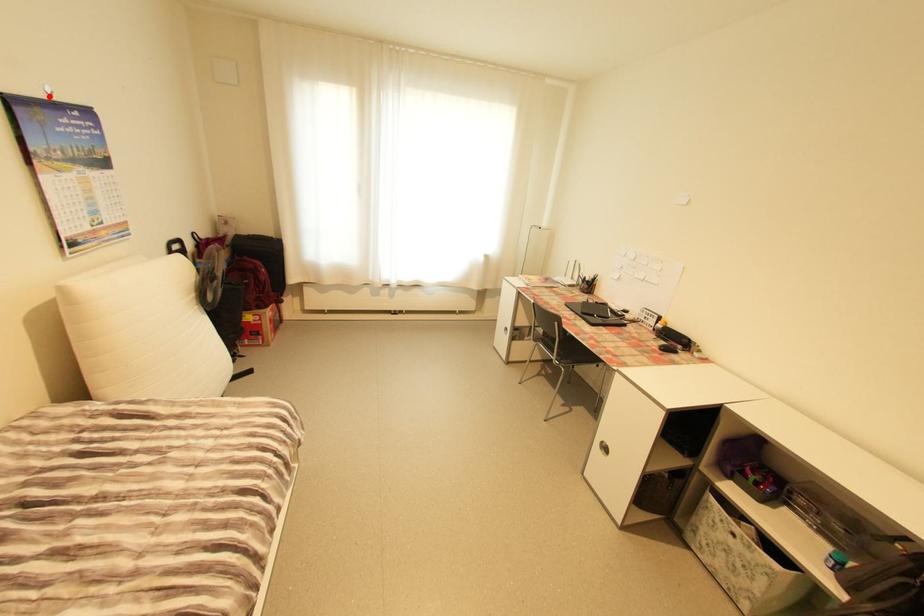
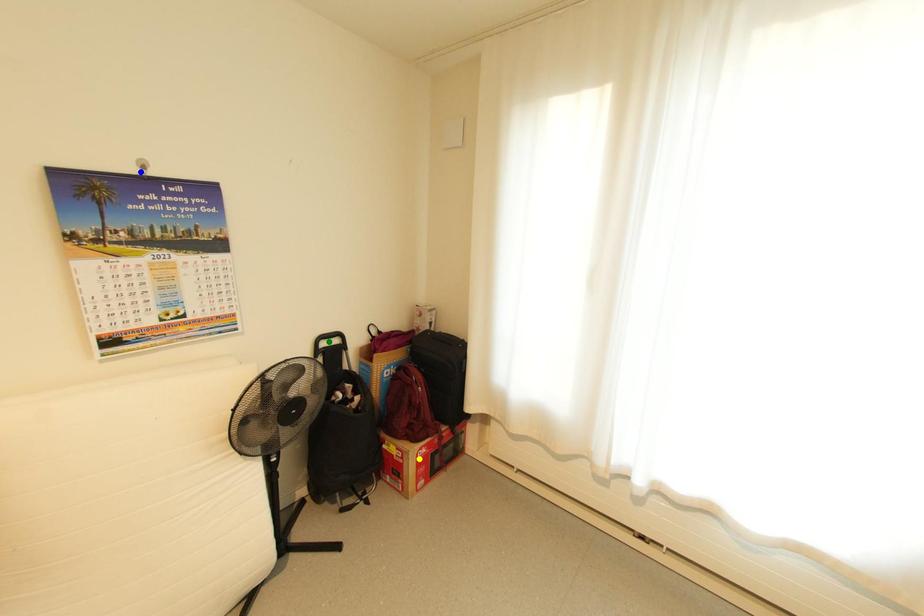
Question: I am providing you with two images of the same scene from different viewpoints. A red point is marked on the first image. You are given multiple points on the second image. Which spot in image 2 lines up with the point in image 1?

Choices:
 (A) yellow point
 (B) blue point
 (C) green point

Answer: (B)